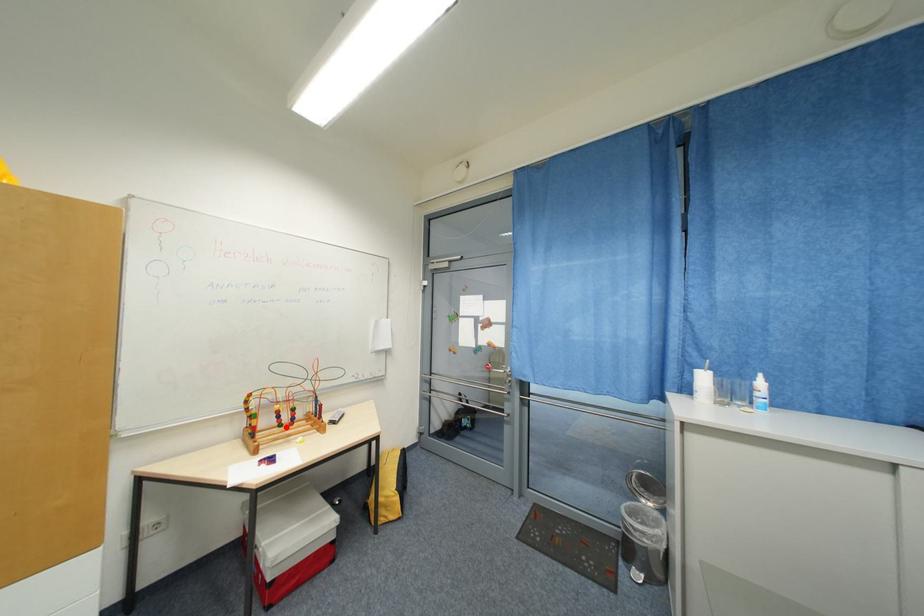
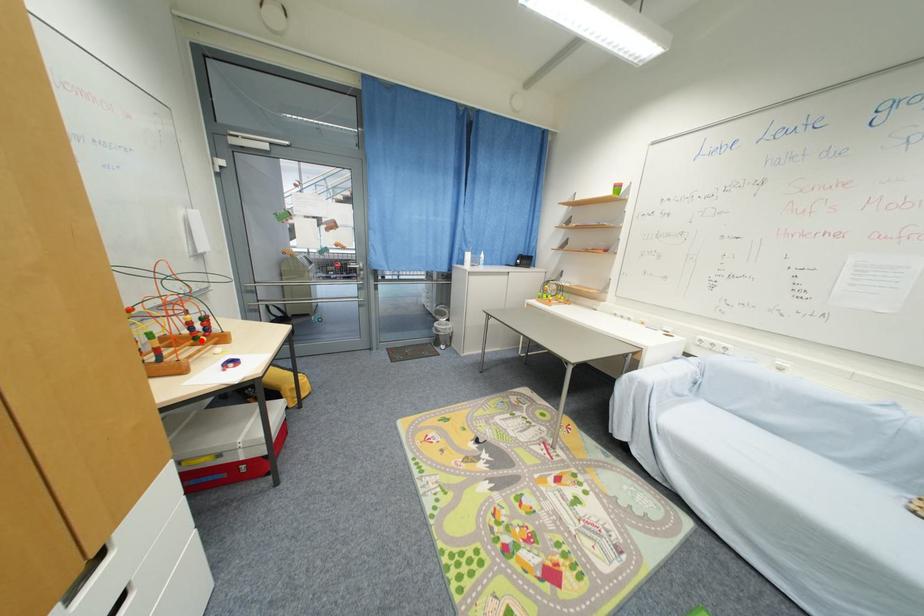
I am providing you with two images of the same scene from different viewpoints. A red point is marked on the first image and another point is marked on the second image. Is the marked point in image1 the same physical position as the marked point in image2?

Yes